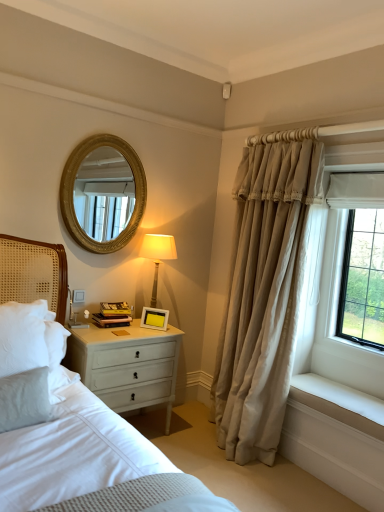
The height and width of the screenshot is (512, 384). Identify the location of vacant area that is in front of white matte picture frame at upper right. pos(154,329).